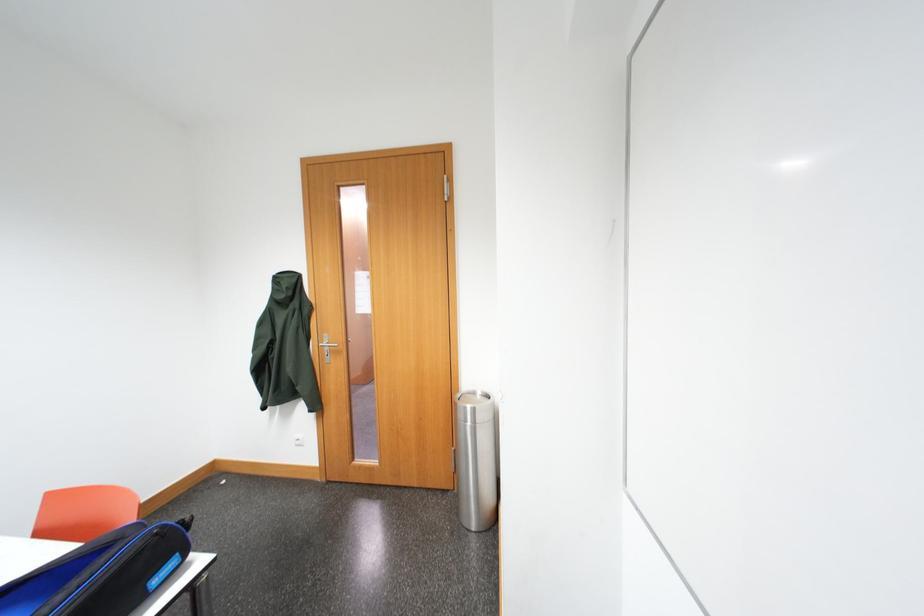
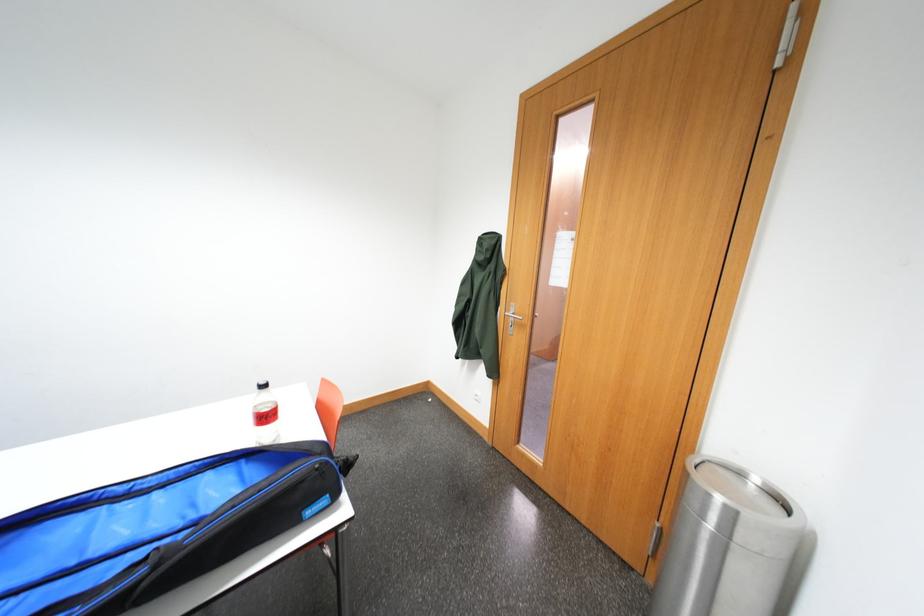
Question: The camera is either moving clockwise (left) or counter-clockwise (right) around the object. The first image is from the beginning of the video and the second image is from the end. Is the camera moving left or right when shooting the video?

Choices:
 (A) Left
 (B) Right

Answer: (B)